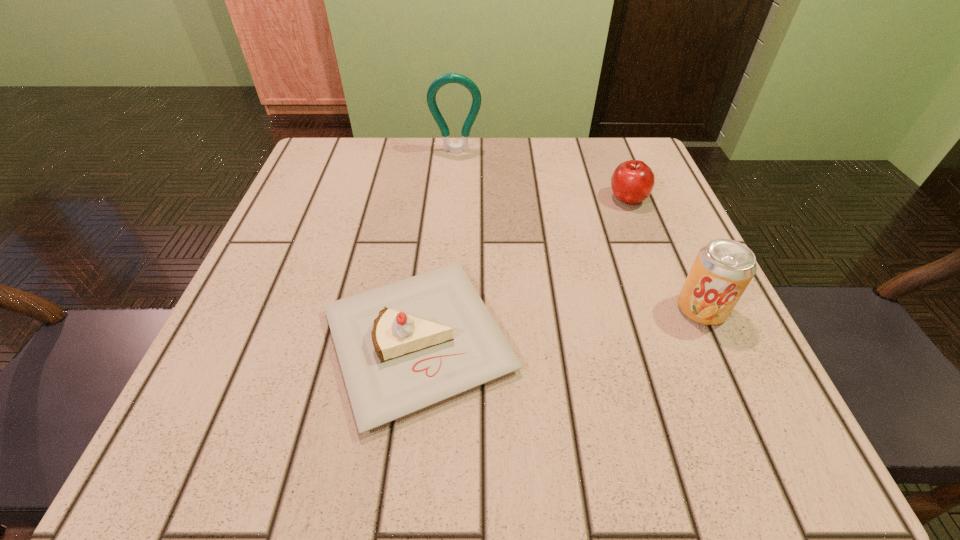
The width and height of the screenshot is (960, 540). In order to click on vacant space at the left edge in this screenshot , I will do `click(331, 205)`.

This screenshot has width=960, height=540. Find the location of `vacant space at the right edge`. vacant space at the right edge is located at coordinates (601, 222).

You are a GUI agent. You are given a task and a screenshot of the screen. Output one action in this format:
    pyautogui.click(x=<x>, y=<y>)
    Task: Click on the free region at the far left corner of the desktop
    This screenshot has width=960, height=540.
    Given the screenshot: What is the action you would take?
    pyautogui.click(x=305, y=187)

The image size is (960, 540). What are the coordinates of `free space at the far right corner` in the screenshot? It's located at (583, 153).

This screenshot has height=540, width=960. In the image, there is a desktop. What are the coordinates of `vacant space at the near right corner` in the screenshot? It's located at (700, 423).

You are a GUI agent. You are given a task and a screenshot of the screen. Output one action in this format:
    pyautogui.click(x=<x>, y=<y>)
    Task: Click on the free space that is in between the farthest object and the second shortest object
    This screenshot has width=960, height=540.
    Given the screenshot: What is the action you would take?
    pyautogui.click(x=542, y=175)

At what (x,y) coordinates should I click in order to perform the action: click on vacant area between the third nearest object and the shortest object. Please return your answer as a coordinate pair (x, y). Looking at the image, I should click on (523, 269).

Where is `unoccupied position between the tallest object and the pop (soda)`? unoccupied position between the tallest object and the pop (soda) is located at coordinates (579, 230).

Identify the location of free space between the third nearest object and the cake. (523, 269).

This screenshot has height=540, width=960. I want to click on free space between the shortest object and the second tallest object, so click(x=560, y=325).